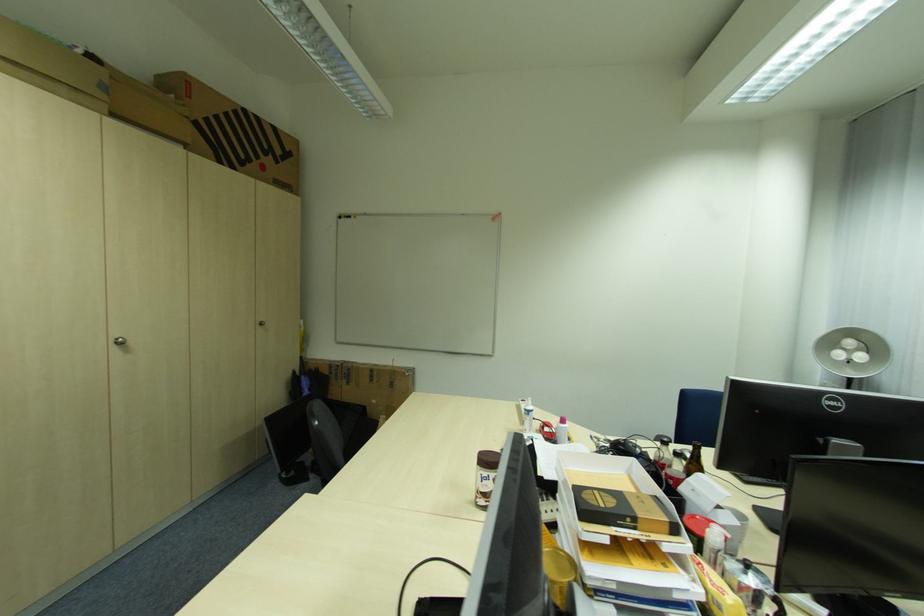
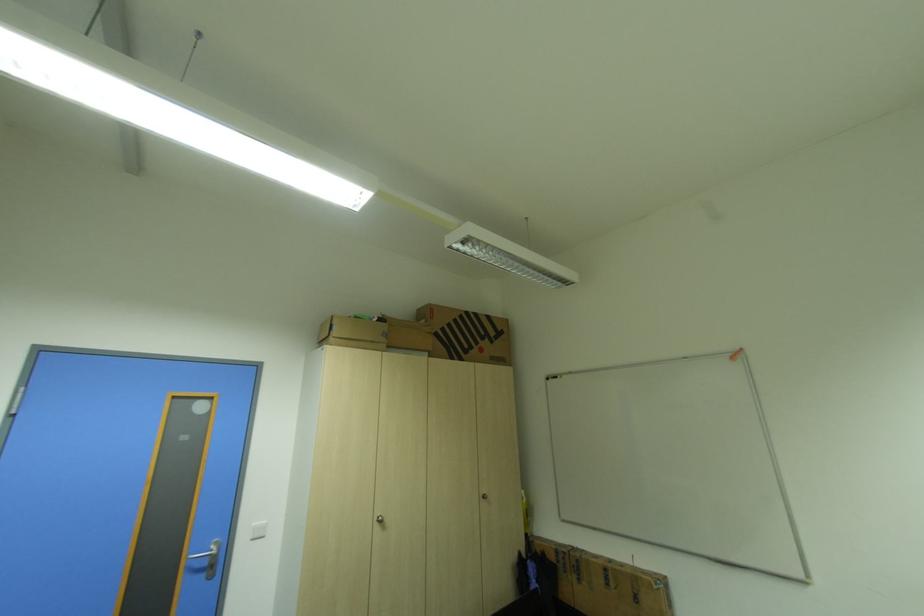
First-person continuous shooting, in which direction is the camera rotating?

The camera's rotation is toward left-up.